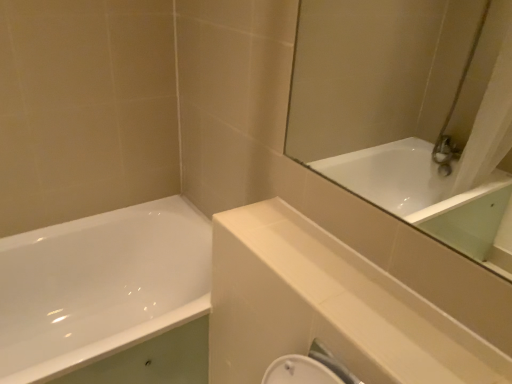
Question: Is white glossy balustrade at upper center thinner than white glossy bathtub at left?

Choices:
 (A) yes
 (B) no

Answer: (A)

Question: From the image's perspective, is white glossy balustrade at upper center under white glossy bathtub at left?

Choices:
 (A) no
 (B) yes

Answer: (A)

Question: From a real-world perspective, is white glossy balustrade at upper center over white glossy bathtub at left?

Choices:
 (A) no
 (B) yes

Answer: (B)

Question: Can you confirm if white glossy balustrade at upper center is positioned to the right of white glossy bathtub at left?

Choices:
 (A) no
 (B) yes

Answer: (B)

Question: Is white glossy balustrade at upper center bigger than white glossy bathtub at left?

Choices:
 (A) yes
 (B) no

Answer: (B)

Question: From a real-world perspective, is white glossy balustrade at upper center under white glossy bathtub at left?

Choices:
 (A) no
 (B) yes

Answer: (A)

Question: Could you tell me if white glossy bathtub at left is facing white glossy balustrade at upper center?

Choices:
 (A) no
 (B) yes

Answer: (A)

Question: Is the depth of white glossy bathtub at left less than that of white glossy balustrade at upper center?

Choices:
 (A) yes
 (B) no

Answer: (B)

Question: Is white glossy bathtub at left with white glossy balustrade at upper center?

Choices:
 (A) no
 (B) yes

Answer: (A)

Question: Does white glossy bathtub at left appear on the left side of white glossy balustrade at upper center?

Choices:
 (A) yes
 (B) no

Answer: (A)

Question: Can you confirm if white glossy bathtub at left is taller than white glossy balustrade at upper center?

Choices:
 (A) no
 (B) yes

Answer: (B)

Question: Is white glossy bathtub at left thinner than white glossy balustrade at upper center?

Choices:
 (A) yes
 (B) no

Answer: (B)

Question: From their relative heights in the image, would you say white glossy balustrade at upper center is taller or shorter than white glossy bathtub at left?

Choices:
 (A) tall
 (B) short

Answer: (B)